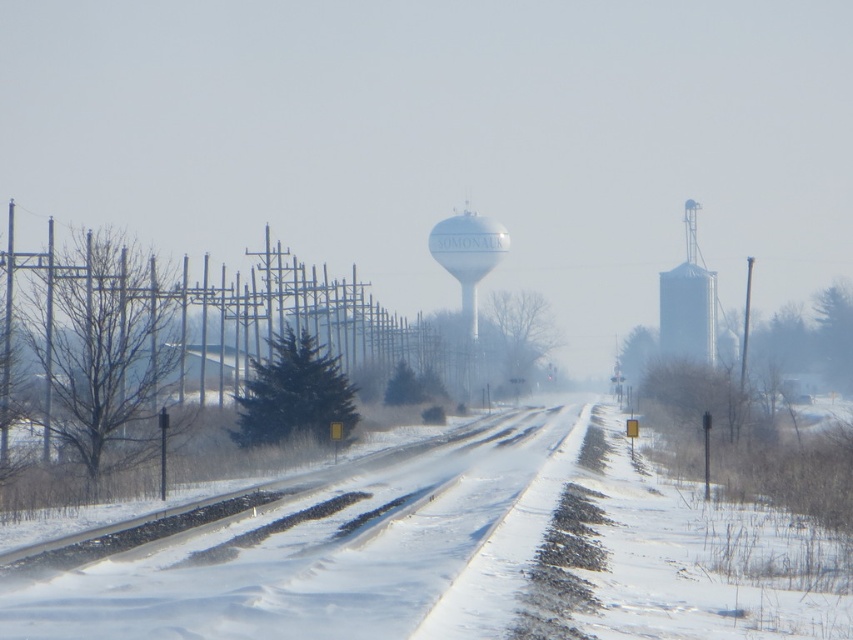
Question: Does white matte silo at right appear under white matte water tower at center?

Choices:
 (A) yes
 (B) no

Answer: (B)

Question: Is snowy asphalt road at center wider than white matte water tower at center?

Choices:
 (A) yes
 (B) no

Answer: (A)

Question: Is snowy asphalt road at center to the left of white matte silo at right from the viewer's perspective?

Choices:
 (A) yes
 (B) no

Answer: (A)

Question: Estimate the real-world distances between objects in this image. Which object is farther from the white matte silo at right?

Choices:
 (A) white matte water tower at center
 (B) snowy asphalt road at center

Answer: (B)

Question: Which of the following is the closest to the observer?

Choices:
 (A) (282, 611)
 (B) (467, 250)
 (C) (688, 324)

Answer: (A)

Question: Which point appears farthest from the camera in this image?

Choices:
 (A) (692, 212)
 (B) (192, 632)

Answer: (A)